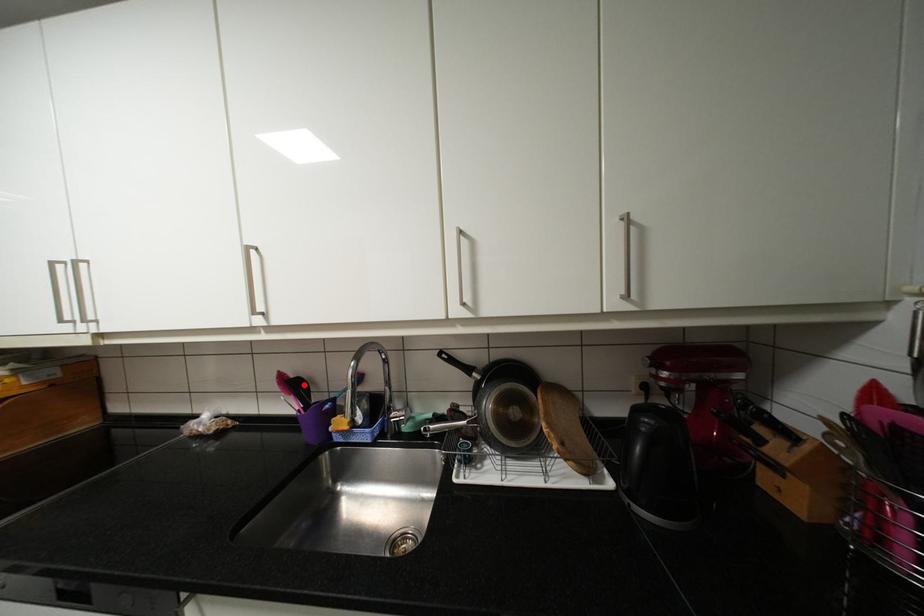
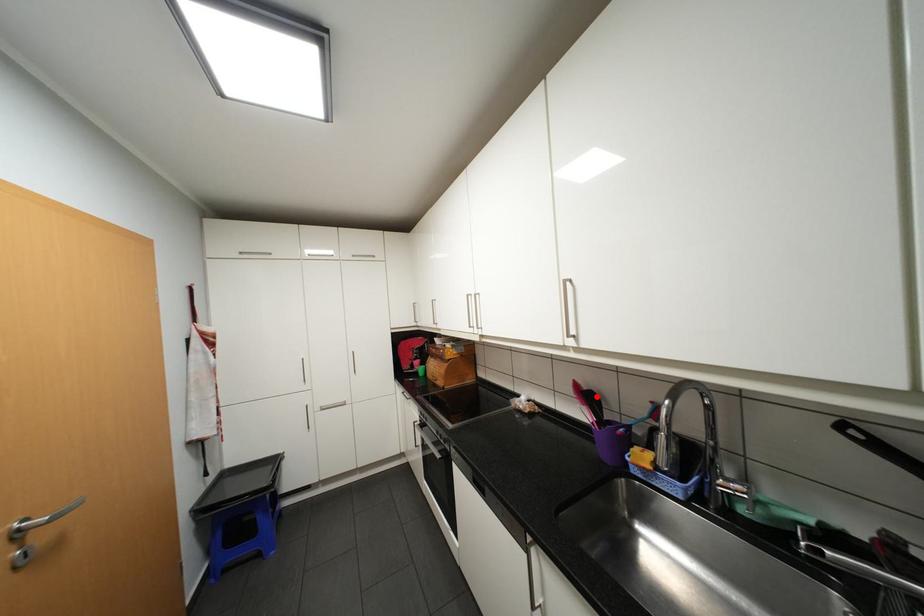
I am providing you with two images of the same scene from different viewpoints. A red point is marked on the first image and another point is marked on the second image. Is the marked point in image1 the same physical position as the marked point in image2?

Yes